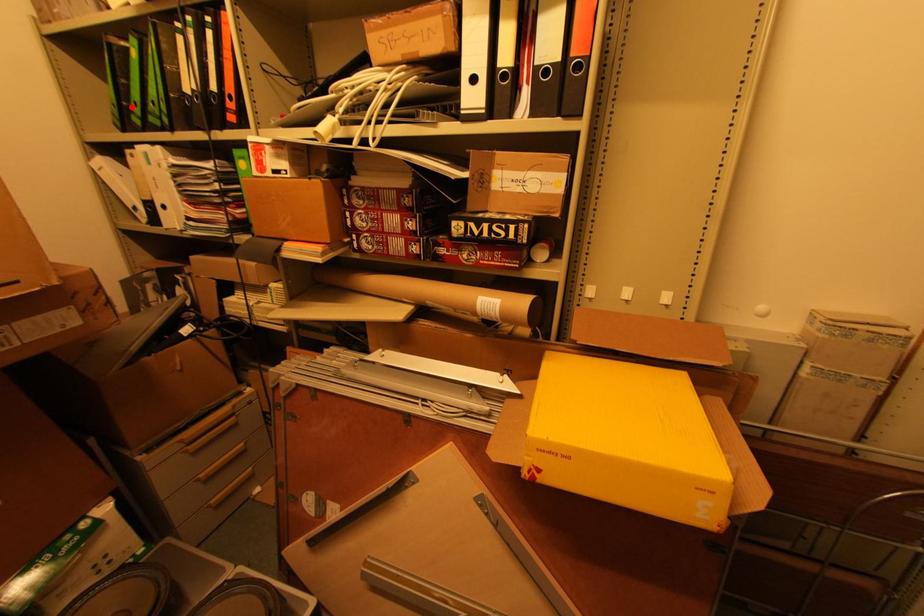
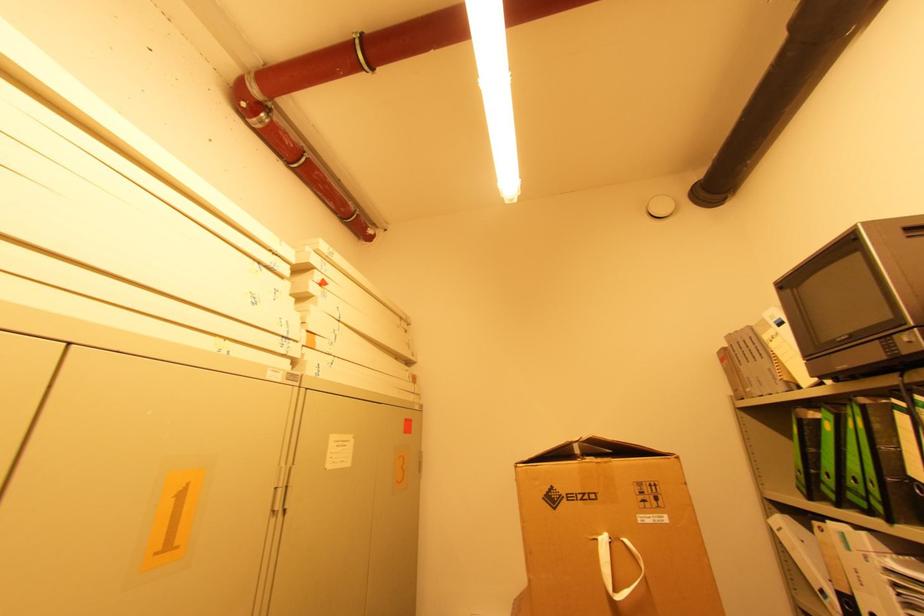
The point at the highlighted location is marked in the first image. Where is the corresponding point in the second image?

(822, 476)